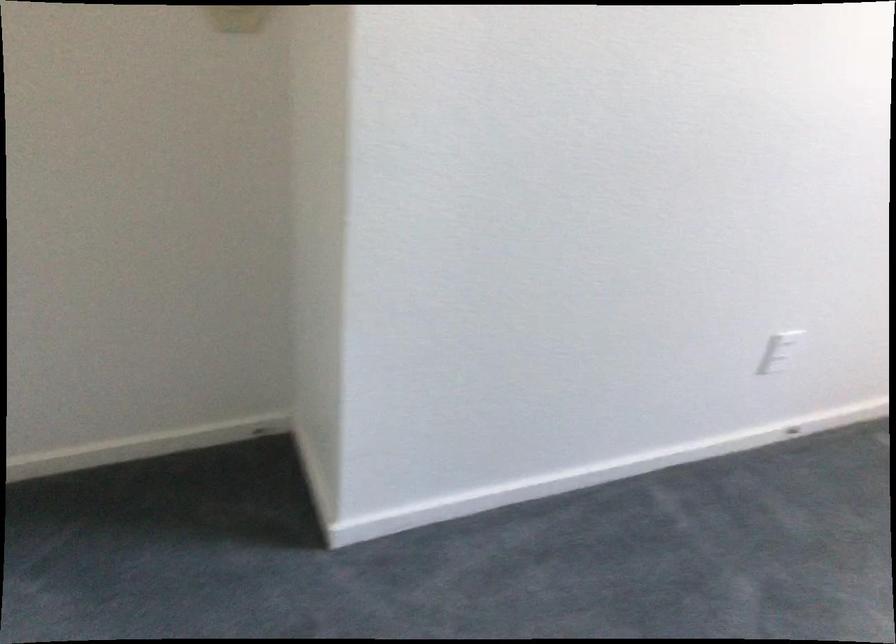
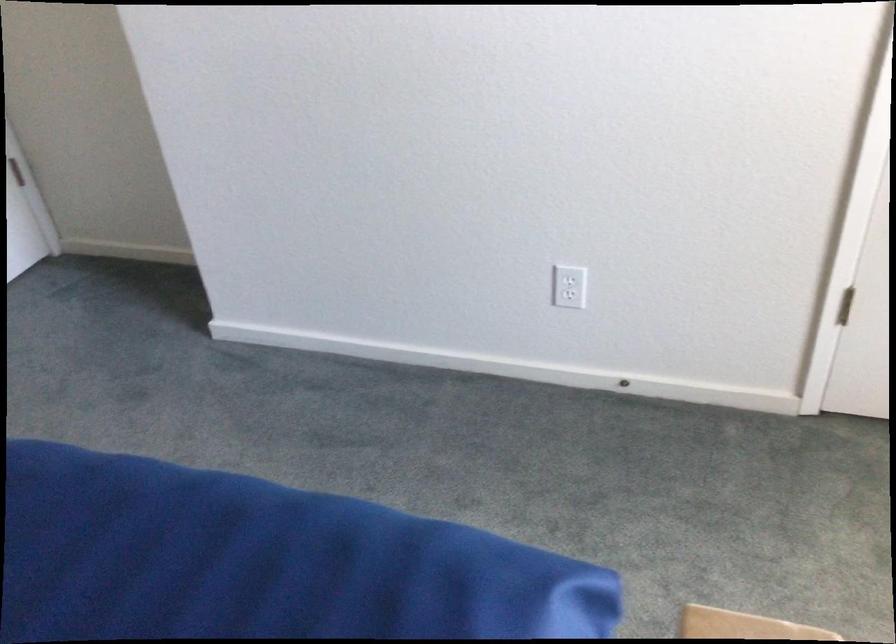
In the second image, find the point that corresponds to pixel 780 433 in the first image.

(624, 384)